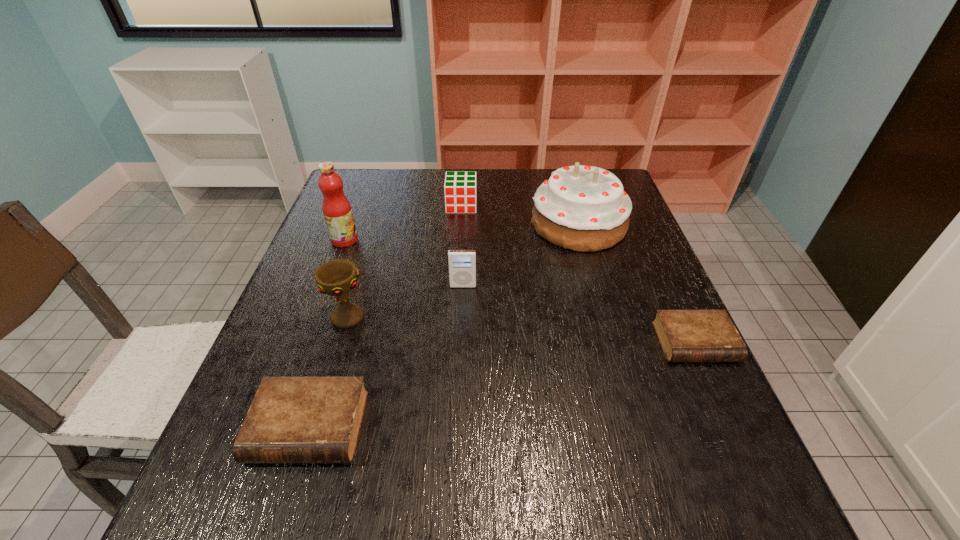
Image resolution: width=960 pixels, height=540 pixels. I want to click on fruit juice positioned at the left edge, so click(x=336, y=208).

This screenshot has height=540, width=960. I want to click on chalice that is at the left edge, so click(x=338, y=277).

Locate an element on the screen. This screenshot has width=960, height=540. diary at the right edge is located at coordinates [x=685, y=335].

The height and width of the screenshot is (540, 960). I want to click on cake that is positioned at the right edge, so click(581, 208).

This screenshot has height=540, width=960. I want to click on object that is at the near left corner, so click(x=291, y=419).

Image resolution: width=960 pixels, height=540 pixels. Find the location of `object that is positioned at the far right corner`. object that is positioned at the far right corner is located at coordinates (581, 208).

I want to click on vacant space at the far edge of the desktop, so click(x=526, y=185).

The height and width of the screenshot is (540, 960). I want to click on vacant space at the near edge of the desktop, so click(412, 449).

At what (x,y) coordinates should I click in order to perform the action: click on vacant space at the left edge. Please return your answer as a coordinate pair (x, y). This screenshot has height=540, width=960. Looking at the image, I should click on pos(366,235).

Locate an element on the screen. The width and height of the screenshot is (960, 540). blank space at the right edge is located at coordinates (653, 393).